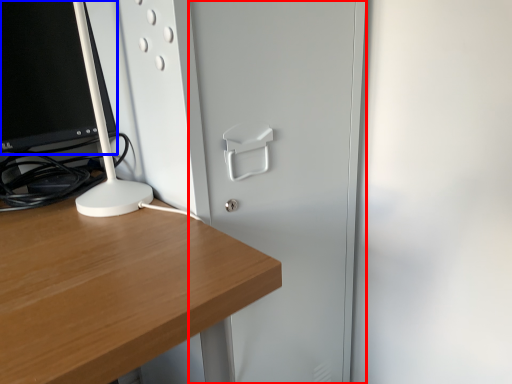
Question: Which object is closer to the camera taking this photo, glass door (highlighted by a red box) or computer monitor (highlighted by a blue box)?

Choices:
 (A) glass door
 (B) computer monitor

Answer: (A)